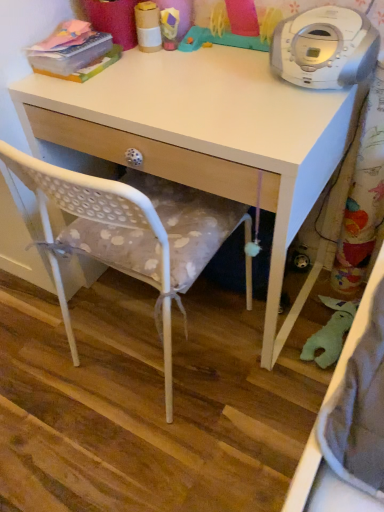
At what (x,y) coordinates should I click in order to perform the action: click on free space in front of white plastic cd player at upper right. Please return your answer as a coordinate pair (x, y). This screenshot has height=512, width=384. Looking at the image, I should click on (294, 122).